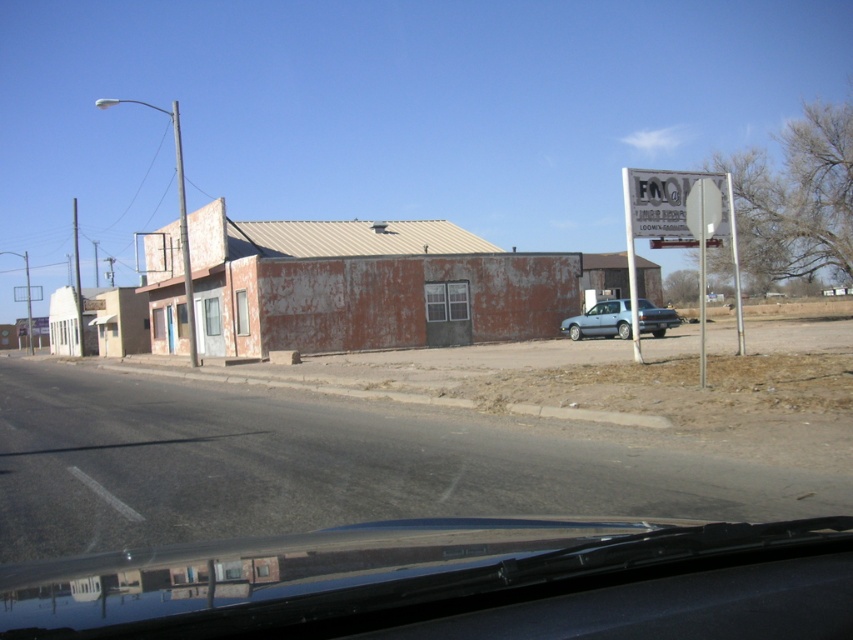
You are driving a car and want to check both the transparent glass windshield at center and the white plastic sign at right. Since you need to know which one is wider, can you determine this without measuring them?

The transparent glass windshield at center is narrower than the white plastic sign at right because its width is less than the sign.

You are a passenger in the car and want to read the white plastic sign at upper right. Can you see it clearly through the transparent glass windshield at center?

The transparent glass windshield at center is positioned under the white plastic sign at upper right, so the windshield is below the sign. Since the windshield is transparent, you should be able to see the white plastic sign at upper right clearly through it.

You are driving a car and see the white plastic sign at upper right at point [668,202]. Is there any building closer to you than the white plastic sign at upper right?

The white plastic sign at upper right is located at point [668,202], which is the closest object to the viewer in this scene. Therefore, there are no buildings closer to you than the white plastic sign at upper right.